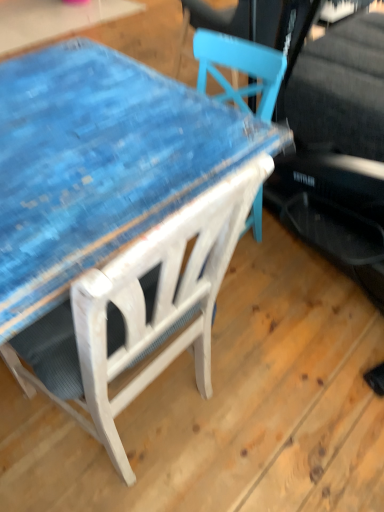
Question: From the image's perspective, would you say white wood chair at upper center is positioned over blue painted wood table at center?

Choices:
 (A) no
 (B) yes

Answer: (A)

Question: Can you confirm if white wood chair at upper center is wider than blue painted wood table at center?

Choices:
 (A) no
 (B) yes

Answer: (B)

Question: From the image's perspective, would you say white wood chair at upper center is shown under blue painted wood table at center?

Choices:
 (A) yes
 (B) no

Answer: (A)

Question: Does white wood chair at upper center contain blue painted wood table at center?

Choices:
 (A) yes
 (B) no

Answer: (B)

Question: Is white wood chair at upper center looking in the opposite direction of blue painted wood table at center?

Choices:
 (A) yes
 (B) no

Answer: (B)

Question: Does white wood chair at upper center have a larger size compared to blue painted wood table at center?

Choices:
 (A) yes
 (B) no

Answer: (A)

Question: From a real-world perspective, is blue painted wood table at center physically above white wood chair at upper center?

Choices:
 (A) yes
 (B) no

Answer: (B)

Question: Is the depth of blue painted wood table at center greater than that of white wood chair at upper center?

Choices:
 (A) no
 (B) yes

Answer: (B)

Question: Does blue painted wood table at center have a greater width compared to white wood chair at upper center?

Choices:
 (A) yes
 (B) no

Answer: (B)

Question: Is blue painted wood table at center bigger than white wood chair at upper center?

Choices:
 (A) no
 (B) yes

Answer: (A)

Question: From the image's perspective, is blue painted wood table at center on white wood chair at upper center?

Choices:
 (A) yes
 (B) no

Answer: (A)

Question: Would you say blue painted wood table at center is outside white wood chair at upper center?

Choices:
 (A) yes
 (B) no

Answer: (A)

Question: Considering the positions of blue painted wood table at center and white wood chair at upper center in the image, is blue painted wood table at center bigger or smaller than white wood chair at upper center?

Choices:
 (A) big
 (B) small

Answer: (B)